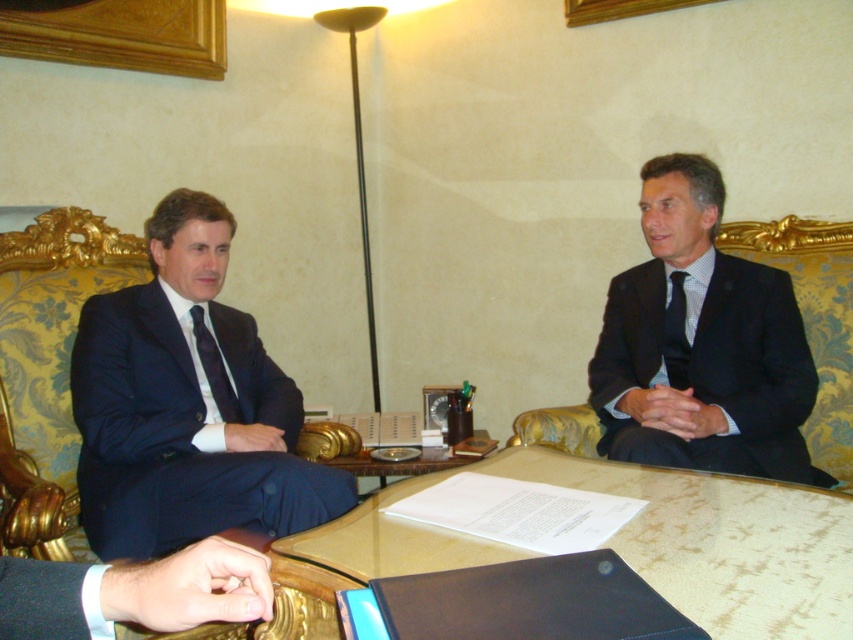
You are a photographer standing 2 meters away from the navy blue suit at left and the matte black tie at right. You want to take a photo that captures both subjects clearly. Given that your camera has a maximum focus range of 1.5 meters, will both subjects be in focus?

The navy blue suit at left is 1.11 meters away from the matte black tie at right. Since the photographer is standing 2 meters away from both subjects, the distance between the photographer and each subject is beyond the camera maximum focus range of 1.5 meters. Therefore, neither the navy blue suit at left nor the matte black tie at right will be in focus.

You are an event planner arranging a photoshoot in this meeting room. You need to place a decorative banner between the navy blue suit at left and the matte black tie at right. Based on their positions, where should you place the banner so it is centered between them?

The navy blue suit at left is positioned under the matte black tie at right, so placing the banner between them would require positioning it horizontally between their vertical positions. Since the navy blue suit is lower, the banner should be centered vertically between the two objects.